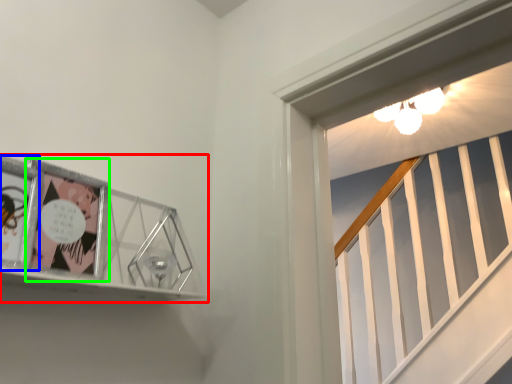
Question: Based on their relative distances, which object is farther from picture frame (highlighted by a red box)? Choose from comic book (highlighted by a blue box) and comic book (highlighted by a green box).

Choices:
 (A) comic book
 (B) comic book

Answer: (A)